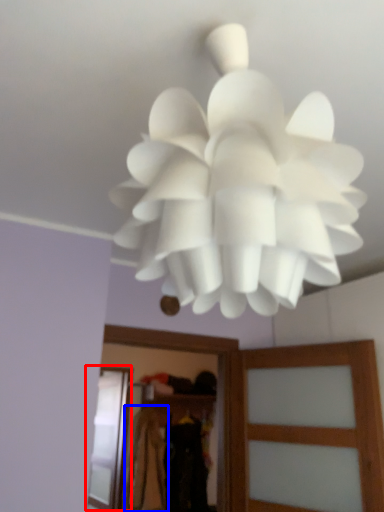
Question: Which object is closer to the camera taking this photo, screen door (highlighted by a red box) or clothing (highlighted by a blue box)?

Choices:
 (A) screen door
 (B) clothing

Answer: (A)